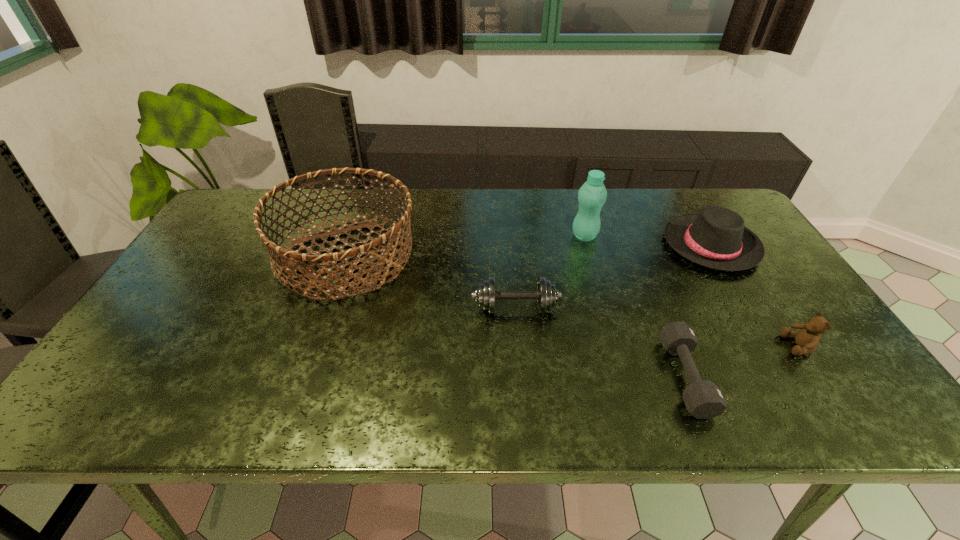
Where is `bottle`? bottle is located at coordinates (592, 195).

Identify the location of the fourth object from right to left. (592, 195).

Where is `the fifth shortest object`? This screenshot has width=960, height=540. the fifth shortest object is located at coordinates (288, 256).

Where is `the leftmost object`? the leftmost object is located at coordinates (288, 256).

Where is `dress hat`? dress hat is located at coordinates (716, 238).

Image resolution: width=960 pixels, height=540 pixels. What are the coordinates of `teddy bear` in the screenshot? It's located at (807, 340).

Locate an element on the screen. the second object from left to right is located at coordinates (546, 295).

Identify the location of the taller dumbbell. Image resolution: width=960 pixels, height=540 pixels. (546, 295).

Locate an element on the screen. This screenshot has width=960, height=540. the shorter dumbbell is located at coordinates (703, 399).

Locate an element on the screen. This screenshot has width=960, height=540. the shortest object is located at coordinates (703, 399).